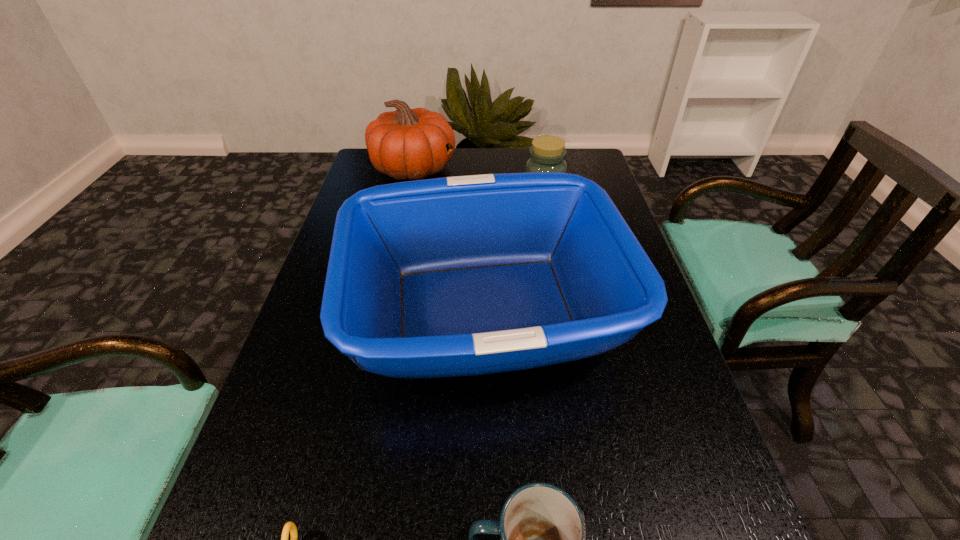
Locate an element on the screen. This screenshot has width=960, height=540. tray that is at the right edge is located at coordinates (457, 276).

Find the location of a particular element. This screenshot has width=960, height=540. jar located at the right edge is located at coordinates (548, 153).

The image size is (960, 540). I want to click on object that is at the far left corner, so click(x=407, y=144).

Find the location of `object located at the far right corner`. object located at the far right corner is located at coordinates (548, 153).

Find the location of a particular element. The width and height of the screenshot is (960, 540). free space at the left edge of the desktop is located at coordinates (276, 415).

In order to click on free space at the right edge in this screenshot , I will do `click(673, 402)`.

What are the coordinates of `blank space at the far right corner of the desktop` in the screenshot? It's located at (567, 149).

Locate an element on the screen. The height and width of the screenshot is (540, 960). the fourth closest object to the fourth tallest object is located at coordinates (407, 144).

The image size is (960, 540). What are the coordinates of `object that is the second nearest to the cup` in the screenshot? It's located at (543, 534).

Identify the location of vacant region that satisfies the following two spatial constraints: 1. on the back side of the tray; 2. on the face of the pumpkin. This screenshot has width=960, height=540. (484, 169).